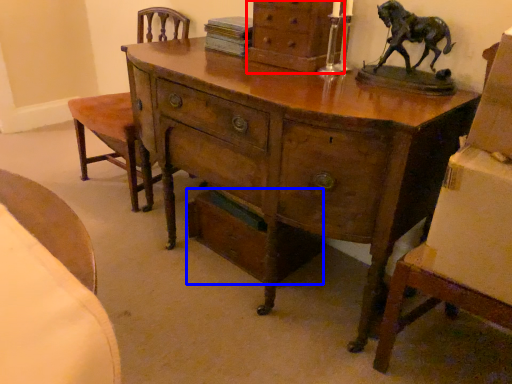
Question: Among these objects, which one is farthest to the camera, chest of drawers (highlighted by a red box) or drawer (highlighted by a blue box)?

Choices:
 (A) chest of drawers
 (B) drawer

Answer: (B)